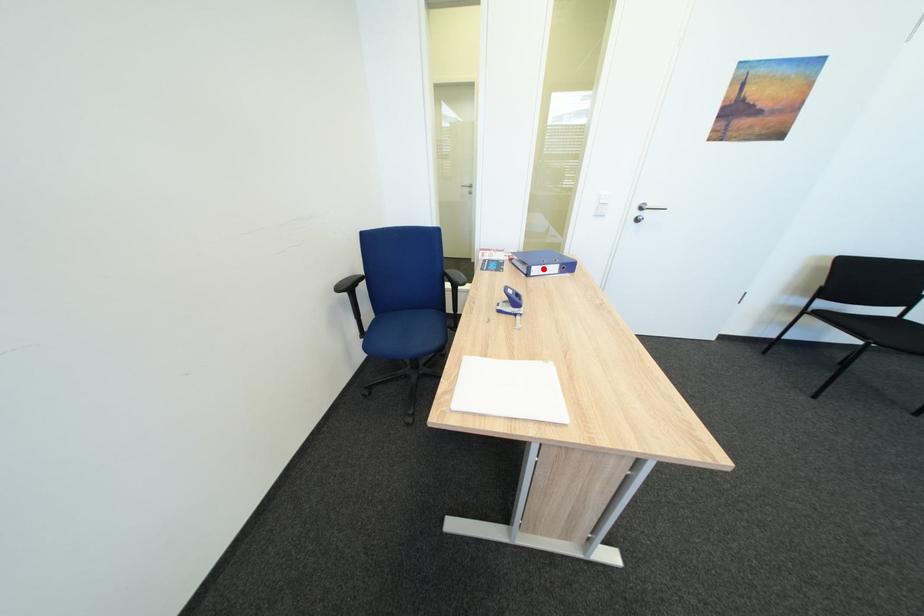
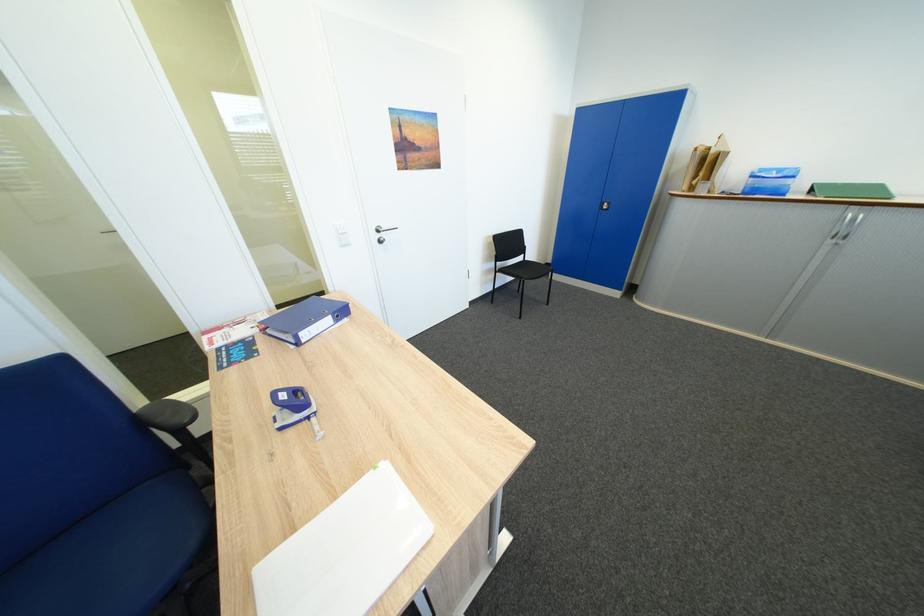
Question: I am providing you with two images of the same scene from different viewpoints. A red point is marked on the first image. Is the red point's position out of view in image 2?

Choices:
 (A) Yes
 (B) No

Answer: (B)